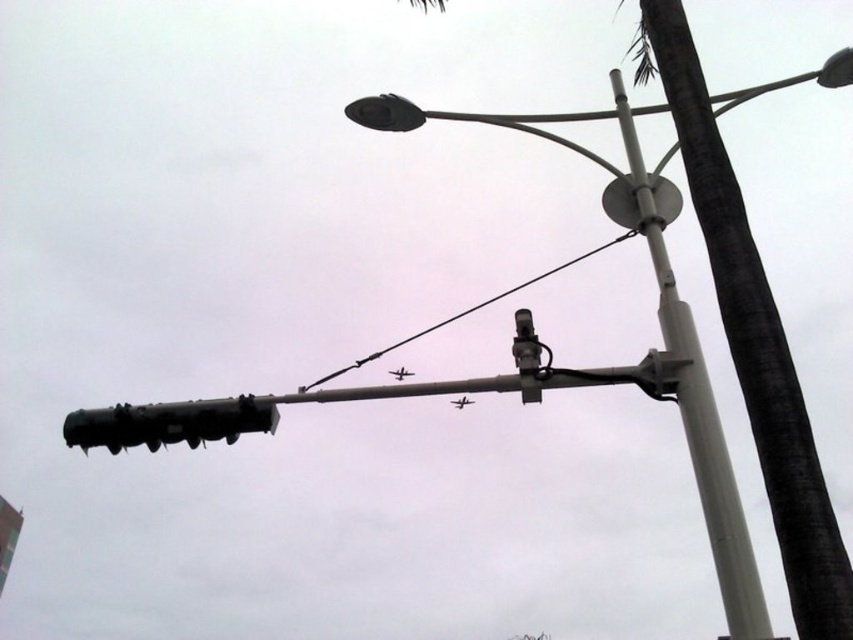
Does white metallic pole at center appear over black matte traffic light at left?

Correct, white metallic pole at center is located above black matte traffic light at left.

Who is positioned more to the right, white metallic pole at center or black matte traffic light at left?

white metallic pole at center

Image resolution: width=853 pixels, height=640 pixels. Find the location of `white metallic pole at center`. white metallic pole at center is located at coordinates (698, 412).

Who is taller, white metallic pole at center or black wire at center?

With more height is white metallic pole at center.

Between point (675, 336) and point (317, 385), which one is positioned in front?

Point (675, 336) is in front.

In order to click on white metallic pole at center in this screenshot , I will do `click(698, 412)`.

Does white plastic street light at upper center have a greater width compared to black matte traffic light at left?

Correct, the width of white plastic street light at upper center exceeds that of black matte traffic light at left.

Who is taller, white plastic street light at upper center or black matte traffic light at left?

Standing taller between the two is white plastic street light at upper center.

Which is in front, point (606, 205) or point (177, 404)?

Point (177, 404) is in front.

Locate an element on the screen. The image size is (853, 640). white plastic street light at upper center is located at coordinates (659, 317).